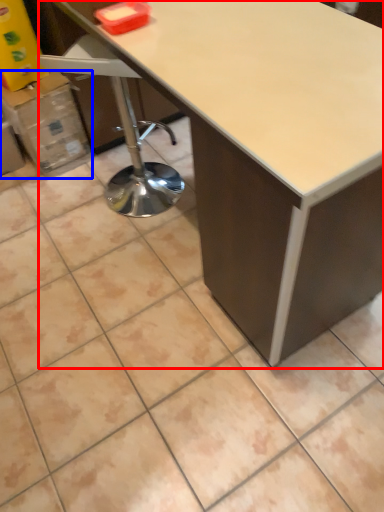
Question: Which of the following is the farthest to the observer, table (highlighted by a red box) or cardboard box (highlighted by a blue box)?

Choices:
 (A) table
 (B) cardboard box

Answer: (B)